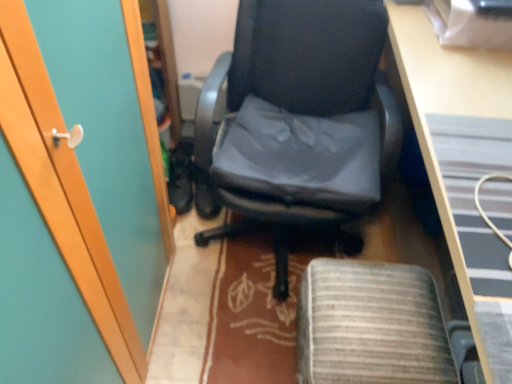
Question: Is black leather chair at center taller than gray fabric computer chair at center?

Choices:
 (A) yes
 (B) no

Answer: (A)

Question: Is black leather chair at center smaller than gray fabric computer chair at center?

Choices:
 (A) yes
 (B) no

Answer: (B)

Question: From a real-world perspective, is black leather chair at center beneath gray fabric computer chair at center?

Choices:
 (A) yes
 (B) no

Answer: (B)

Question: Is black leather chair at center positioned beyond the bounds of gray fabric computer chair at center?

Choices:
 (A) no
 (B) yes

Answer: (B)

Question: Can you confirm if black leather chair at center is thinner than gray fabric computer chair at center?

Choices:
 (A) yes
 (B) no

Answer: (B)

Question: In the image, is black leather shoes at lower left positioned in front of or behind black leather chair at center?

Choices:
 (A) front
 (B) behind

Answer: (B)

Question: In the image, is black leather shoes at lower left on the left side or the right side of black leather chair at center?

Choices:
 (A) right
 (B) left

Answer: (B)

Question: In terms of height, does black leather shoes at lower left look taller or shorter compared to black leather chair at center?

Choices:
 (A) short
 (B) tall

Answer: (A)

Question: From a real-world perspective, is black leather shoes at lower left physically located above or below black leather chair at center?

Choices:
 (A) above
 (B) below

Answer: (B)

Question: From the image's perspective, is wooden desk at center located above or below black leather chair at center?

Choices:
 (A) above
 (B) below

Answer: (B)

Question: Considering the positions of point (426, 158) and point (250, 168), is point (426, 158) closer or farther from the camera than point (250, 168)?

Choices:
 (A) closer
 (B) farther

Answer: (A)

Question: Is wooden desk at center wider or thinner than black leather chair at center?

Choices:
 (A) thin
 (B) wide

Answer: (A)

Question: Is wooden desk at center situated inside black leather chair at center or outside?

Choices:
 (A) outside
 (B) inside

Answer: (A)

Question: From the image's perspective, is wooden desk at center positioned above or below black leather shoes at lower left?

Choices:
 (A) below
 (B) above

Answer: (A)

Question: Based on their sizes in the image, would you say wooden desk at center is bigger or smaller than black leather shoes at lower left?

Choices:
 (A) small
 (B) big

Answer: (B)